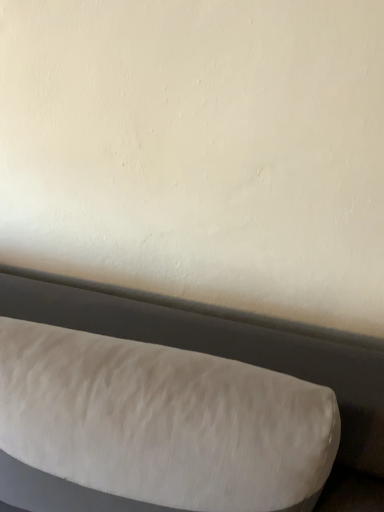
Locate an element on the screen. white fabric cushion at lower center is located at coordinates (223, 346).

Image resolution: width=384 pixels, height=512 pixels. What do you see at coordinates (223, 346) in the screenshot?
I see `white fabric cushion at lower center` at bounding box center [223, 346].

Identify the location of white fabric cushion at lower center. (223, 346).